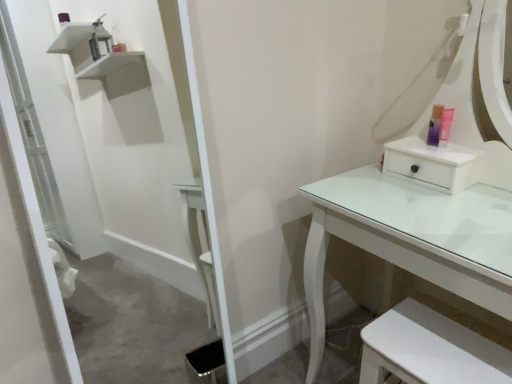
Question: Is point (430, 337) closer or farther from the camera than point (434, 122)?

Choices:
 (A) closer
 (B) farther

Answer: (A)

Question: Would you say white glossy step stool at lower right is to the left or to the right of translucent plastic container at upper right in the picture?

Choices:
 (A) right
 (B) left

Answer: (B)

Question: Considering the positions of white glossy step stool at lower right and translucent plastic container at upper right in the image, is white glossy step stool at lower right wider or thinner than translucent plastic container at upper right?

Choices:
 (A) wide
 (B) thin

Answer: (A)

Question: Would you say translucent plastic container at upper right is inside or outside white glossy step stool at lower right?

Choices:
 (A) outside
 (B) inside

Answer: (A)

Question: Looking at their shapes, would you say translucent plastic container at upper right is wider or thinner than white glossy step stool at lower right?

Choices:
 (A) wide
 (B) thin

Answer: (B)

Question: Is translucent plastic container at upper right bigger or smaller than white glossy step stool at lower right?

Choices:
 (A) small
 (B) big

Answer: (A)

Question: Considering their positions, is translucent plastic container at upper right located in front of or behind white glossy step stool at lower right?

Choices:
 (A) front
 (B) behind

Answer: (B)